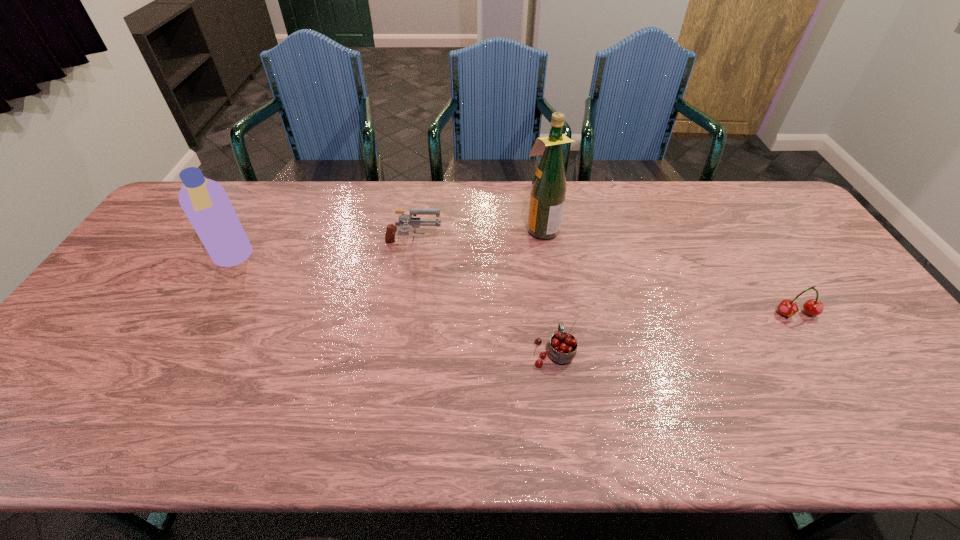
The width and height of the screenshot is (960, 540). I want to click on free space between the rightmost object and the fourth shortest object, so click(x=515, y=286).

Find the location of a particular element. The height and width of the screenshot is (540, 960). free space that is in between the nearer cherry and the fourth object from right to left is located at coordinates (484, 298).

This screenshot has width=960, height=540. In order to click on free space between the gun and the rightmost object in this screenshot , I will do `click(605, 279)`.

Find the location of a particular element. free spot between the liquor and the right cherry is located at coordinates (669, 271).

Select which object appears as the closest to the liquor. Please provide its 2D coordinates. Your answer should be formatted as a tuple, i.e. [(x, y)], where the tuple contains the x and y coordinates of a point satisfying the conditions above.

[(403, 218)]

Find the location of a particular element. The image size is (960, 540). object that is the fourth closest to the gun is located at coordinates (814, 307).

This screenshot has height=540, width=960. I want to click on free location that satisfies the following two spatial constraints: 1. at the barrel end of the gun; 2. on the handle side of the nearest object, so click(x=396, y=352).